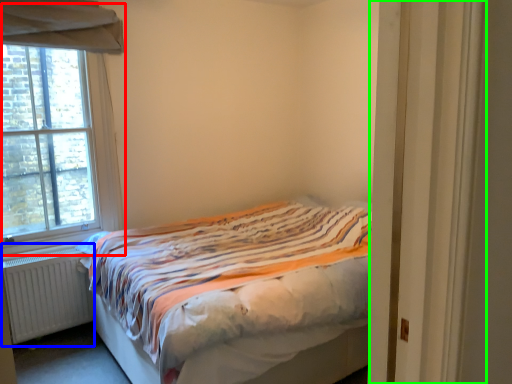
Question: Based on their relative distances, which object is nearer to window (highlighted by a red box)? Choose from radiator (highlighted by a blue box) and door (highlighted by a green box).

Choices:
 (A) radiator
 (B) door

Answer: (A)